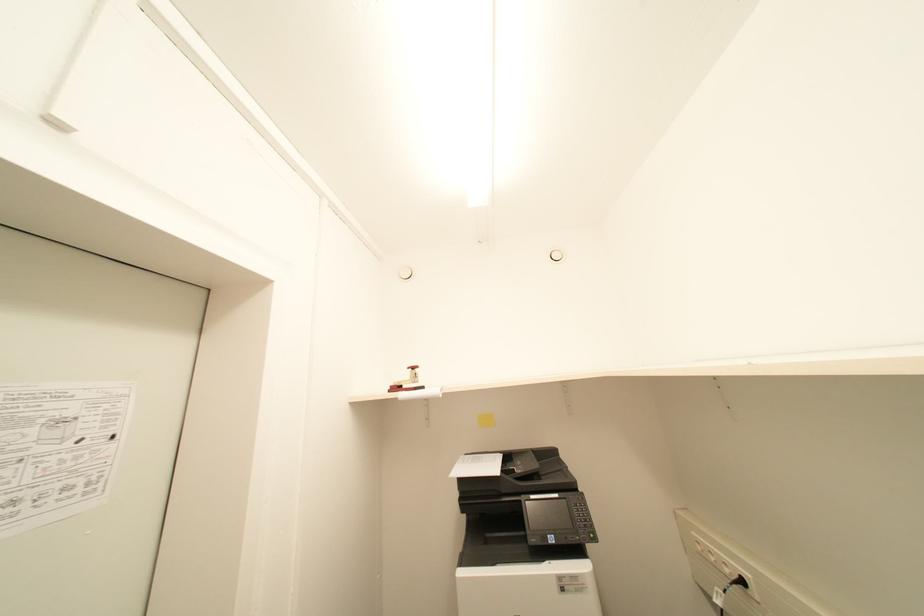
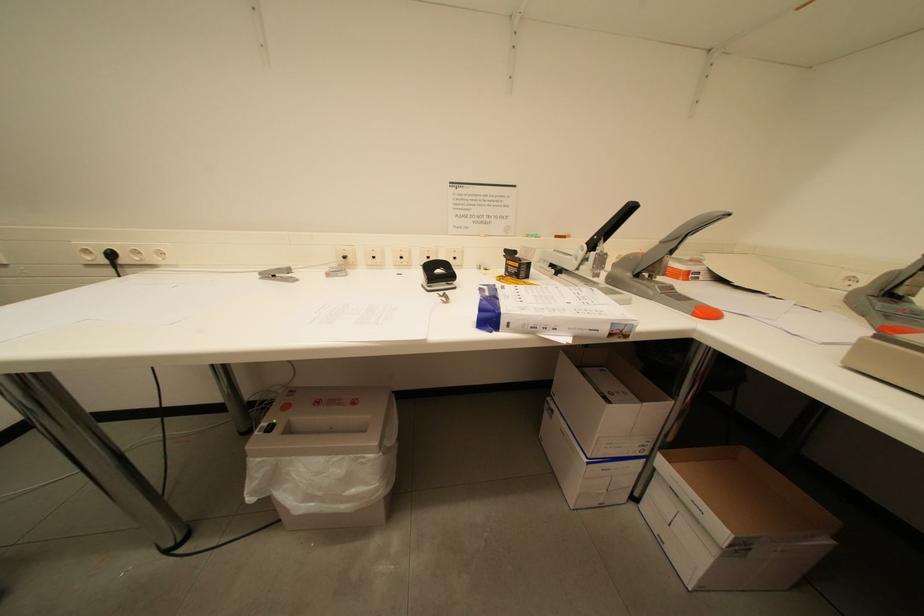
Question: The first image is from the beginning of the video and the second image is from the end. How did the camera likely rotate when shooting the video?

Choices:
 (A) Left
 (B) Right
 (C) Up
 (D) Down

Answer: (B)